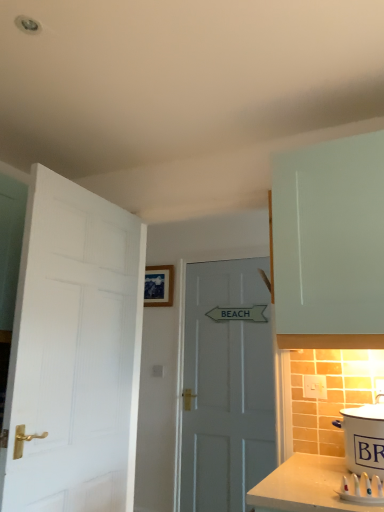
Question: Can white wooden door at center, arranged as the second door when viewed from the front, be found inside white matte door at left, positioned as the second door in back-to-front order?

Choices:
 (A) no
 (B) yes

Answer: (A)

Question: Can you confirm if white matte door at left, positioned as the second door in back-to-front order, is smaller than white wooden door at center, arranged as the first door when viewed from the right?

Choices:
 (A) no
 (B) yes

Answer: (A)

Question: Is white matte door at left, marked as the first door in a front-to-back arrangement, thinner than white wooden door at center, which is the second door from left to right?

Choices:
 (A) no
 (B) yes

Answer: (A)

Question: Is the depth of white matte door at left, positioned as the second door in back-to-front order, greater than that of white wooden door at center, placed as the first door when sorted from back to front?

Choices:
 (A) yes
 (B) no

Answer: (B)

Question: Considering the relative positions of white matte door at left, the 1th door positioned from the left, and white wooden door at center, which is the second door from left to right, in the image provided, is white matte door at left, the 1th door positioned from the left, to the left of white wooden door at center, which is the second door from left to right, from the viewer's perspective?

Choices:
 (A) no
 (B) yes

Answer: (B)

Question: From a real-world perspective, is white matte door at left, the 1th door positioned from the left, positioned above or below white ceramic pot at lower right?

Choices:
 (A) above
 (B) below

Answer: (A)

Question: Relative to white ceramic pot at lower right, is white matte door at left, arranged as the 2th door when viewed from the right, in front or behind?

Choices:
 (A) front
 (B) behind

Answer: (B)

Question: From the image's perspective, is white matte door at left, arranged as the 2th door when viewed from the right, located above or below white ceramic pot at lower right?

Choices:
 (A) above
 (B) below

Answer: (A)

Question: In terms of width, does white matte door at left, the 1th door positioned from the left, look wider or thinner when compared to white ceramic pot at lower right?

Choices:
 (A) wide
 (B) thin

Answer: (B)

Question: Is white plastic toothbrushes at lower right situated inside white matte door at left, positioned as the second door in back-to-front order, or outside?

Choices:
 (A) inside
 (B) outside

Answer: (B)

Question: In the image, is white plastic toothbrushes at lower right on the left side or the right side of white matte door at left, arranged as the 2th door when viewed from the right?

Choices:
 (A) left
 (B) right

Answer: (B)

Question: Considering their positions, is white plastic toothbrushes at lower right located in front of or behind white matte door at left, marked as the first door in a front-to-back arrangement?

Choices:
 (A) behind
 (B) front

Answer: (B)

Question: Looking at their shapes, would you say white plastic toothbrushes at lower right is wider or thinner than white matte door at left, positioned as the second door in back-to-front order?

Choices:
 (A) thin
 (B) wide

Answer: (A)

Question: From the image's perspective, is white plastic toothbrushes at lower right above or below white plastic electric outlet at lower right?

Choices:
 (A) above
 (B) below

Answer: (B)

Question: Considering the positions of white plastic toothbrushes at lower right and white plastic electric outlet at lower right in the image, is white plastic toothbrushes at lower right wider or thinner than white plastic electric outlet at lower right?

Choices:
 (A) thin
 (B) wide

Answer: (B)